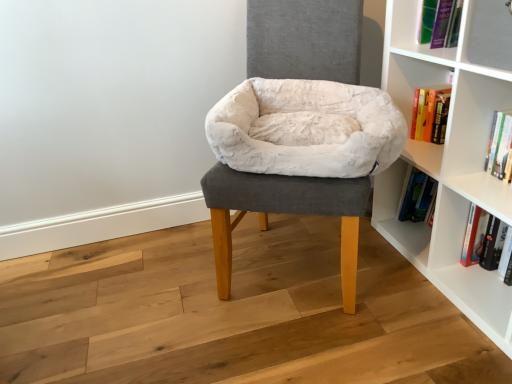
Question: Does white plush pet bed at center contain white plush bean bag at center?

Choices:
 (A) no
 (B) yes

Answer: (B)

Question: From the image's perspective, is white plush pet bed at center above white plush bean bag at center?

Choices:
 (A) no
 (B) yes

Answer: (A)

Question: Considering the relative sizes of white plush pet bed at center and white plush bean bag at center in the image provided, is white plush pet bed at center bigger than white plush bean bag at center?

Choices:
 (A) no
 (B) yes

Answer: (B)

Question: Is white plush pet bed at center behind white plush bean bag at center?

Choices:
 (A) yes
 (B) no

Answer: (B)

Question: From the image's perspective, would you say white plush pet bed at center is shown under white plush bean bag at center?

Choices:
 (A) no
 (B) yes

Answer: (B)

Question: Based on their sizes in the image, would you say hardcover book at lower right, which is the first book in bottom-to-top order, is bigger or smaller than white plush pet bed at center?

Choices:
 (A) big
 (B) small

Answer: (B)

Question: Would you say hardcover book at lower right, which is the first book in bottom-to-top order, is to the left or to the right of white plush pet bed at center in the picture?

Choices:
 (A) left
 (B) right

Answer: (B)

Question: From the image's perspective, is hardcover book at lower right, which is counted as the 2th book, starting from the top, located above or below white plush pet bed at center?

Choices:
 (A) below
 (B) above

Answer: (A)

Question: Considering the positions of point (470, 220) and point (296, 193), is point (470, 220) closer or farther from the camera than point (296, 193)?

Choices:
 (A) farther
 (B) closer

Answer: (A)

Question: In the image, is hardcover book at upper right, the 2th book ordered from the bottom, on the left side or the right side of white plush pet bed at center?

Choices:
 (A) right
 (B) left

Answer: (A)

Question: Is hardcover book at upper right, the first book from the top, in front of or behind white plush pet bed at center in the image?

Choices:
 (A) behind
 (B) front

Answer: (A)

Question: From the image's perspective, is hardcover book at upper right, the first book from the top, positioned above or below white plush pet bed at center?

Choices:
 (A) below
 (B) above

Answer: (A)

Question: From their relative heights in the image, would you say hardcover book at upper right, the first book from the top, is taller or shorter than white plush pet bed at center?

Choices:
 (A) tall
 (B) short

Answer: (B)

Question: In terms of size, does white plush pet bed at center appear bigger or smaller than white plush bean bag at center?

Choices:
 (A) small
 (B) big

Answer: (B)

Question: Considering the positions of point (301, 165) and point (360, 96), is point (301, 165) closer or farther from the camera than point (360, 96)?

Choices:
 (A) farther
 (B) closer

Answer: (B)